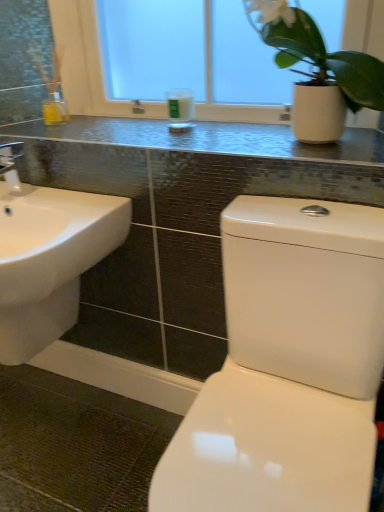
You are a GUI agent. You are given a task and a screenshot of the screen. Output one action in this format:
    pyautogui.click(x=<x>, y=<y>)
    Task: Click on the white glossy toilet at lower right
    This screenshot has width=384, height=512.
    Given the screenshot: What is the action you would take?
    pyautogui.click(x=287, y=366)

Image resolution: width=384 pixels, height=512 pixels. What do you see at coordinates (319, 55) in the screenshot?
I see `white matte pot at upper right` at bounding box center [319, 55].

You are a GUI agent. You are given a task and a screenshot of the screen. Output one action in this format:
    pyautogui.click(x=<x>, y=<y>)
    Task: Click on the white glass candle at center
    Image resolution: width=384 pixels, height=512 pixels.
    Given the screenshot: What is the action you would take?
    180,110

Locate an element on the screen. This screenshot has height=512, width=384. white glossy toilet at lower right is located at coordinates (287, 366).

Does white frosted glass at upper center have a greater height compared to metallic mosaic tile counter top at upper center?

Yes, white frosted glass at upper center is taller than metallic mosaic tile counter top at upper center.

Is point (221, 44) closer to camera compared to point (196, 149)?

No, (221, 44) is behind (196, 149).

Find the location of a particular element. The image size is (384, 512). counter top below the white frosted glass at upper center (from a real-world perspective) is located at coordinates (208, 139).

Is white frosted glass at upper center bigger or smaller than metallic mosaic tile counter top at upper center?

white frosted glass at upper center is bigger than metallic mosaic tile counter top at upper center.

Based on the photo, is white glass candle at center not near white glossy toilet at lower right?

That's not correct — white glass candle at center is a little close to white glossy toilet at lower right.

From the image's perspective, which one is positioned lower, white glass candle at center or white glossy toilet at lower right?

From the image's view, white glossy toilet at lower right is below.

Considering the relative sizes of white glass candle at center and white glossy toilet at lower right in the image provided, is white glass candle at center shorter than white glossy toilet at lower right?

Yes.

What are the coordinates of `toilet in front of the white glass candle at center` in the screenshot? It's located at (287, 366).

Does metallic mosaic tile counter top at upper center have a smaller size compared to white matte pot at upper right?

Yes, metallic mosaic tile counter top at upper center is smaller than white matte pot at upper right.

Would you say metallic mosaic tile counter top at upper center is outside white matte pot at upper right?

Yes, metallic mosaic tile counter top at upper center is outside of white matte pot at upper right.

What are the coordinates of `counter top located on the left of white matte pot at upper right` in the screenshot? It's located at (208, 139).

Who is more distant, metallic mosaic tile counter top at upper center or white matte pot at upper right?

metallic mosaic tile counter top at upper center is further away from the camera.

Between point (18, 302) and point (335, 303), which one is positioned behind?

The point (18, 302) is farther from the camera.

Based on the photo, is white glossy sink at lower left facing away from white glossy toilet at lower right?

white glossy sink at lower left does not have its back to white glossy toilet at lower right.

From a real-world perspective, relative to white glossy toilet at lower right, is white glossy sink at lower left vertically above or below?

From a real-world perspective, white glossy sink at lower left is physically above white glossy toilet at lower right.

Which is behind, white glossy sink at lower left or white glossy toilet at lower right?

white glossy sink at lower left is more distant.

In the image, is white matte pot at upper right on the left side or the right side of white glass candle at center?

Based on their positions, white matte pot at upper right is located to the right of white glass candle at center.

Is white matte pot at upper right situated inside white glass candle at center or outside?

white matte pot at upper right is not inside white glass candle at center, it's outside.

Based on the photo, how different are the orientations of white matte pot at upper right and white glass candle at center in degrees?

0.164 degrees.

Is white matte pot at upper right positioned in front of white glass candle at center?

Yes, white matte pot at upper right is closer to the camera.

From the image's perspective, which is below, metallic mosaic tile counter top at upper center or white glass candle at center?

metallic mosaic tile counter top at upper center.

Where is `toiletry on the right of the metallic mosaic tile counter top at upper center`? This screenshot has height=512, width=384. toiletry on the right of the metallic mosaic tile counter top at upper center is located at coordinates (180, 110).

Is metallic mosaic tile counter top at upper center looking in the opposite direction of white glass candle at center?

That's not correct — metallic mosaic tile counter top at upper center is not looking away from white glass candle at center.

Between metallic mosaic tile counter top at upper center and white glass candle at center, which one is positioned behind?

white glass candle at center is further from the camera.

Is point (171, 94) in front of point (83, 139)?

No, (171, 94) is behind (83, 139).

Is white glass candle at center next to metallic mosaic tile counter top at upper center?

No, white glass candle at center is not with metallic mosaic tile counter top at upper center.

Considering the sizes of objects white glass candle at center and metallic mosaic tile counter top at upper center in the image provided, who is thinner, white glass candle at center or metallic mosaic tile counter top at upper center?

white glass candle at center is thinner.

Measure the distance between white glass candle at center and metallic mosaic tile counter top at upper center.

white glass candle at center is 8.05 inches from metallic mosaic tile counter top at upper center.

You are a GUI agent. You are given a task and a screenshot of the screen. Output one action in this format:
    pyautogui.click(x=<x>, y=<y>)
    Task: Click on the counter top lying on the left of white frosted glass at upper center
    This screenshot has height=512, width=384.
    Given the screenshot: What is the action you would take?
    pyautogui.click(x=208, y=139)

Where is `toilet that is below the white glass candle at center (from the image's perspective)`? toilet that is below the white glass candle at center (from the image's perspective) is located at coordinates (287, 366).

Estimate the real-world distances between objects in this image. Which object is further from metallic mosaic tile counter top at upper center, white frosted glass at upper center or white glossy sink at lower left?

Among the two, white glossy sink at lower left is located further to metallic mosaic tile counter top at upper center.

From the image, which object appears to be farther from white glossy sink at lower left, white matte pot at upper right or white glass candle at center?

white matte pot at upper right.

Based on their spatial positions, is white glossy sink at lower left or white glass candle at center closer to white frosted glass at upper center?

Among the two, white glass candle at center is located nearer to white frosted glass at upper center.

Based on their spatial positions, is white glossy toilet at lower right or white glossy sink at lower left further from white glass candle at center?

white glossy toilet at lower right is positioned further to the anchor white glass candle at center.

Looking at the image, which one is located closer to white glossy toilet at lower right, white glossy sink at lower left or white frosted glass at upper center?

white glossy sink at lower left lies closer to white glossy toilet at lower right than the other object.

Which object lies further to the anchor point white glass candle at center, white glossy sink at lower left or white frosted glass at upper center?

white glossy sink at lower left lies further to white glass candle at center than the other object.

Estimate the real-world distances between objects in this image. Which object is closer to white glass candle at center, white frosted glass at upper center or white glossy sink at lower left?

Among the two, white frosted glass at upper center is located nearer to white glass candle at center.

Estimate the real-world distances between objects in this image. Which object is further from white glass candle at center, white glossy toilet at lower right or white matte pot at upper right?

Based on the image, white glossy toilet at lower right appears to be further to white glass candle at center.

Where is `counter top between white matte pot at upper right and white glossy toilet at lower right from top to bottom`? The height and width of the screenshot is (512, 384). counter top between white matte pot at upper right and white glossy toilet at lower right from top to bottom is located at coordinates (208, 139).

I want to click on houseplant that lies between white frosted glass at upper center and white glossy toilet at lower right from top to bottom, so click(319, 55).

Where is `window screen between white matte pot at upper right and white glass candle at center along the z-axis`? The width and height of the screenshot is (384, 512). window screen between white matte pot at upper right and white glass candle at center along the z-axis is located at coordinates (152, 47).

At what (x,y) coordinates should I click in order to perform the action: click on window screen situated between metallic mosaic tile counter top at upper center and white matte pot at upper right from left to right. Please return your answer as a coordinate pair (x, y). The width and height of the screenshot is (384, 512). Looking at the image, I should click on (152, 47).